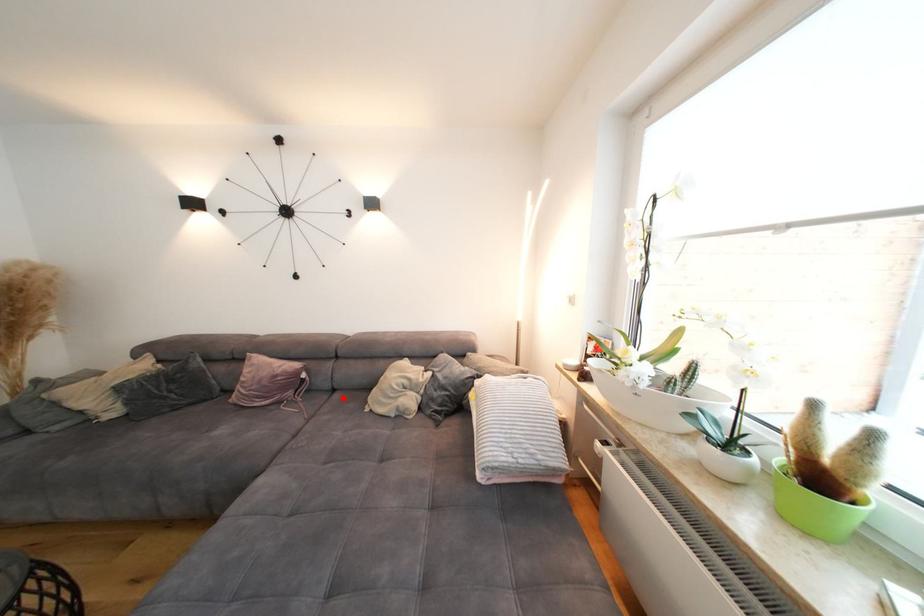
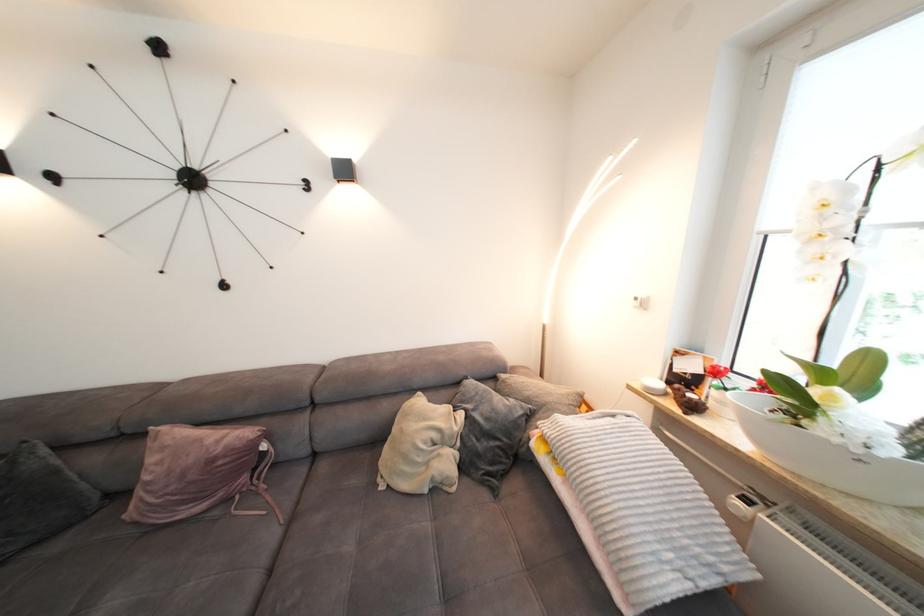
Question: I am providing you with two images of the same scene from different viewpoints. Given a red point in image1, look at the same physical point in image2. Is it:

Choices:
 (A) Closer to the viewpoint
 (B) Farther from the viewpoint

Answer: (B)